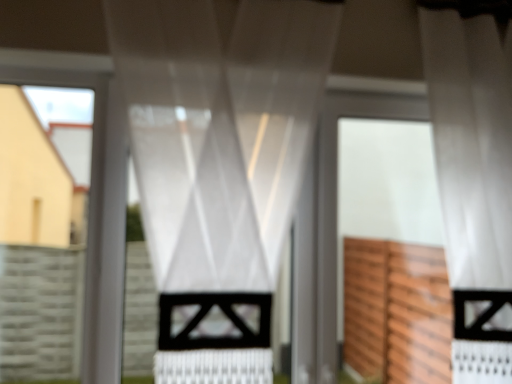
Question: Should I look upward or downward to see white matte screen door at center?

Choices:
 (A) down
 (B) up

Answer: (A)

Question: Does satin white curtain at center, which is counted as the second curtain, starting from the right, have a greater width compared to white matte screen door at center?

Choices:
 (A) no
 (B) yes

Answer: (A)

Question: From a real-world perspective, is satin white curtain at center, which is counted as the second curtain, starting from the right, on white matte screen door at center?

Choices:
 (A) no
 (B) yes

Answer: (B)

Question: Can you confirm if satin white curtain at center, which is the 1th curtain in left-to-right order, is shorter than white matte screen door at center?

Choices:
 (A) yes
 (B) no

Answer: (B)

Question: Is satin white curtain at center, which is the 1th curtain in left-to-right order, closer to the viewer compared to white matte screen door at center?

Choices:
 (A) yes
 (B) no

Answer: (A)

Question: Is white matte screen door at center at the back of satin white curtain at center, which is counted as the second curtain, starting from the right?

Choices:
 (A) yes
 (B) no

Answer: (B)

Question: Is satin white curtain at center, which is the 1th curtain in left-to-right order, not near white matte screen door at center?

Choices:
 (A) yes
 (B) no

Answer: (B)

Question: From the image's perspective, is white matte screen door at center on top of white sheer curtain at center, the 2th curtain from the left?

Choices:
 (A) yes
 (B) no

Answer: (B)

Question: Does white matte screen door at center have a larger size compared to white sheer curtain at center, acting as the 1th curtain starting from the right?

Choices:
 (A) no
 (B) yes

Answer: (A)

Question: From the image's perspective, does white matte screen door at center appear lower than white sheer curtain at center, the 2th curtain from the left?

Choices:
 (A) no
 (B) yes

Answer: (B)

Question: Is the position of white matte screen door at center more distant than that of white sheer curtain at center, acting as the 1th curtain starting from the right?

Choices:
 (A) no
 (B) yes

Answer: (B)

Question: Does white matte screen door at center have a greater width compared to white sheer curtain at center, acting as the 1th curtain starting from the right?

Choices:
 (A) yes
 (B) no

Answer: (B)

Question: From a real-world perspective, is white matte screen door at center positioned under white sheer curtain at center, the 2th curtain from the left, based on gravity?

Choices:
 (A) yes
 (B) no

Answer: (A)

Question: From the image's perspective, is white sheer curtain at center, the 2th curtain from the left, under white matte screen door at center?

Choices:
 (A) no
 (B) yes

Answer: (A)